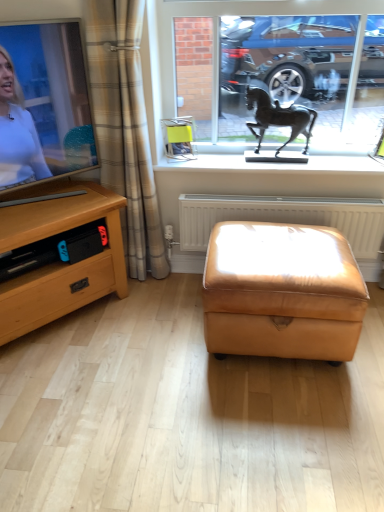
Question: From the image's perspective, is bronze horse at center above or below metallic horse statue at upper center?

Choices:
 (A) above
 (B) below

Answer: (B)

Question: Based on their sizes in the image, would you say bronze horse at center is bigger or smaller than metallic horse statue at upper center?

Choices:
 (A) small
 (B) big

Answer: (A)

Question: Based on their relative distances, which object is nearer to the beige plaid curtain at left?

Choices:
 (A) white plastic radiator at center
 (B) bronze horse at center
 (C) white glossy window sill at upper center
 (D) yellow fabric picture frame at center
 (E) metallic horse statue at upper center

Answer: (D)

Question: Estimate the real-world distances between objects in this image. Which object is farther from the white glossy window sill at upper center?

Choices:
 (A) beige plaid curtain at left
 (B) yellow fabric picture frame at center
 (C) bronze horse at center
 (D) white plastic radiator at center
 (E) matte black tv at left

Answer: (E)